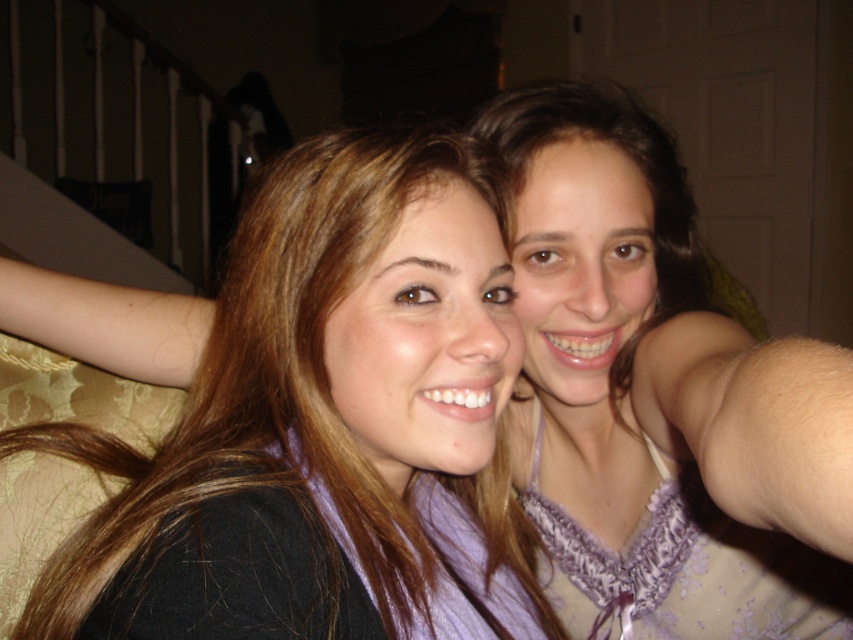
Can you confirm if matte purple scarf at center is positioned below purple lace dress at upper right?

Incorrect, matte purple scarf at center is not positioned below purple lace dress at upper right.

Consider the image. Is matte purple scarf at center above purple lace dress at upper right?

Yes, matte purple scarf at center is above purple lace dress at upper right.

Image resolution: width=853 pixels, height=640 pixels. I want to click on matte purple scarf at center, so click(x=306, y=417).